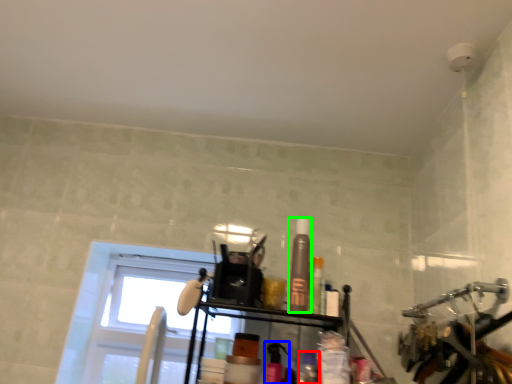
Question: Which object is positioned closest to toiletry (highlighted by a red box)? Select from toiletry (highlighted by a blue box) and toiletry (highlighted by a green box).

Choices:
 (A) toiletry
 (B) toiletry

Answer: (A)